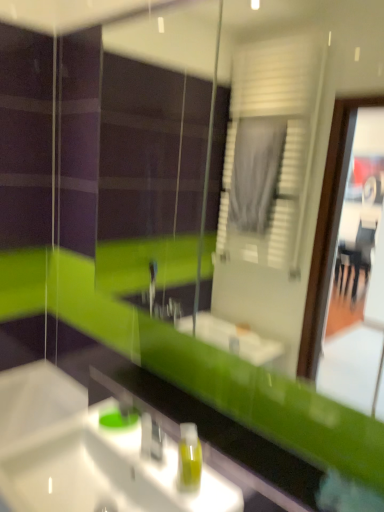
What are the coordinates of `vacant area that lies between teal glass soap dispenser at center and green translucent soap dispenser at lower center` in the screenshot? It's located at (143, 446).